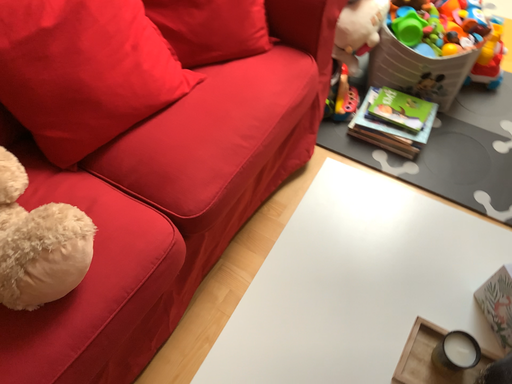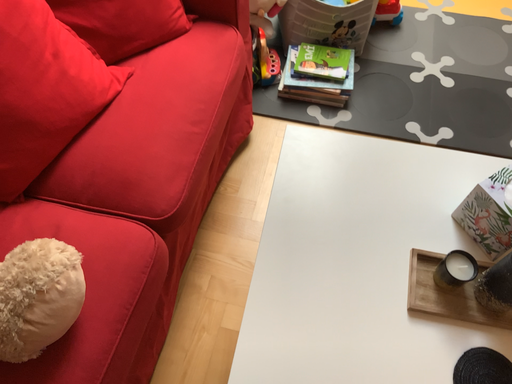
Question: Which way did the camera rotate in the video?

Choices:
 (A) rotated left
 (B) rotated right

Answer: (B)